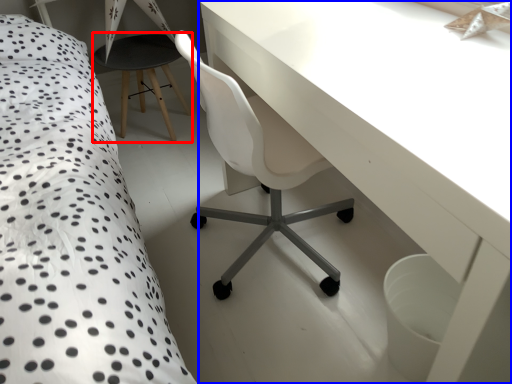
Question: Which point is closer to the camera, bar stool (highlighted by a red box) or table (highlighted by a blue box)?

Choices:
 (A) bar stool
 (B) table

Answer: (B)